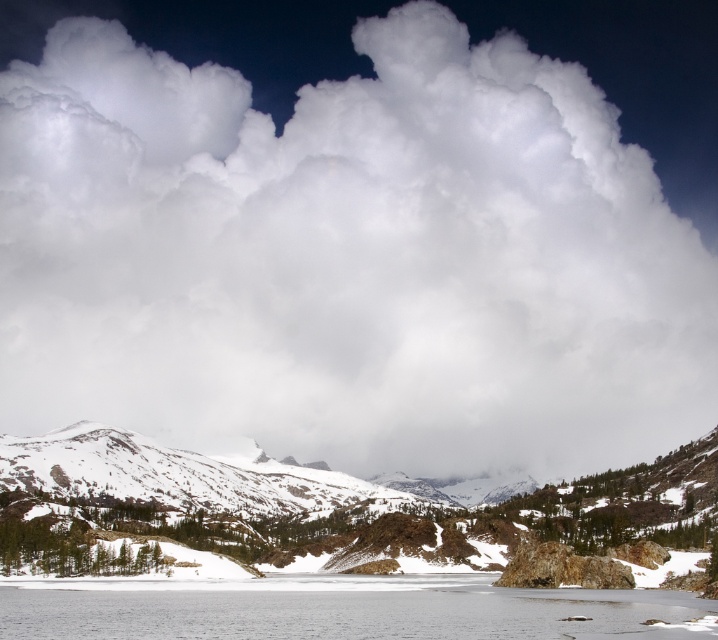
Measure the distance from snowy granite mountain at lower left to clear ice water at lower center.

The distance of snowy granite mountain at lower left from clear ice water at lower center is 88.73 meters.

Does snowy granite mountain at lower left have a lesser height compared to clear ice water at lower center?

No.

Identify the location of snowy granite mountain at lower left. (335, 515).